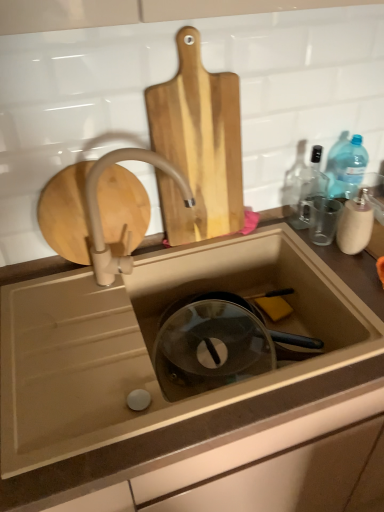
The image size is (384, 512). I want to click on vacant space that is to the left of transparent glass bottle at upper right, so click(270, 227).